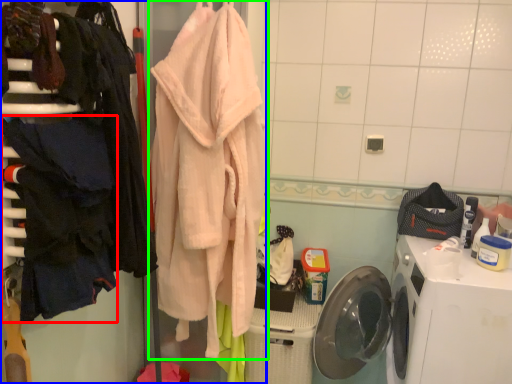
Question: Considering the real-world distances, which object is farthest from clothing (highlighted by a red box)? closet (highlighted by a blue box) or towel (highlighted by a green box)?

Choices:
 (A) closet
 (B) towel

Answer: (B)